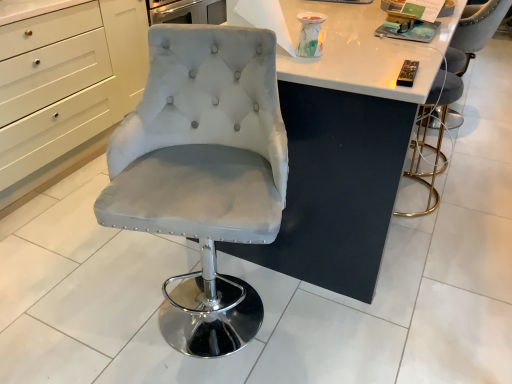
Identify the location of vacant space underneath satin white chair at center, arranged as the first chair when viewed from the front (from a real-world perspective). [x=217, y=312].